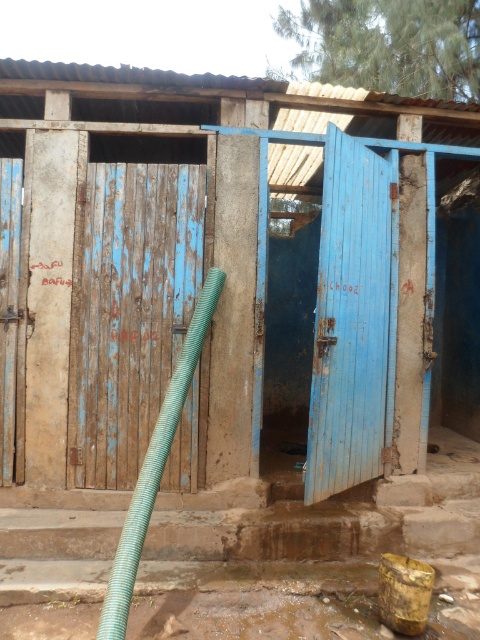
Which is below, green corrugated hose at left or blue wooden door at left?

Positioned lower is green corrugated hose at left.

Looking at this image, who is higher up, green corrugated hose at left or blue wooden door at left?

blue wooden door at left is above.

Is point (105, 628) more distant than point (12, 268)?

No, (105, 628) is in front of (12, 268).

This screenshot has height=640, width=480. Identify the location of green corrugated hose at left. (155, 467).

Does point (349, 156) come closer to viewer compared to point (19, 161)?

Yes, it is in front of point (19, 161).

Is blue painted wood door at center behind blue wooden door at left?

No, it is in front of blue wooden door at left.

This screenshot has height=640, width=480. In order to click on blue painted wood door at center in this screenshot , I will do `click(352, 317)`.

Find the location of `blue painted wood door at center`. blue painted wood door at center is located at coordinates click(352, 317).

Which is behind, point (74, 336) or point (388, 204)?

The point (388, 204) is behind.

Does weathered wood door at center have a lesser height compared to blue painted wood door at center?

Yes, weathered wood door at center is shorter than blue painted wood door at center.

Does point (86, 444) come in front of point (384, 220)?

Yes.

You are a GUI agent. You are given a task and a screenshot of the screen. Output one action in this format:
    pyautogui.click(x=<x>, y=<y>)
    Task: Click on the weathered wood door at center
    
    Given the screenshot: What is the action you would take?
    click(x=130, y=310)